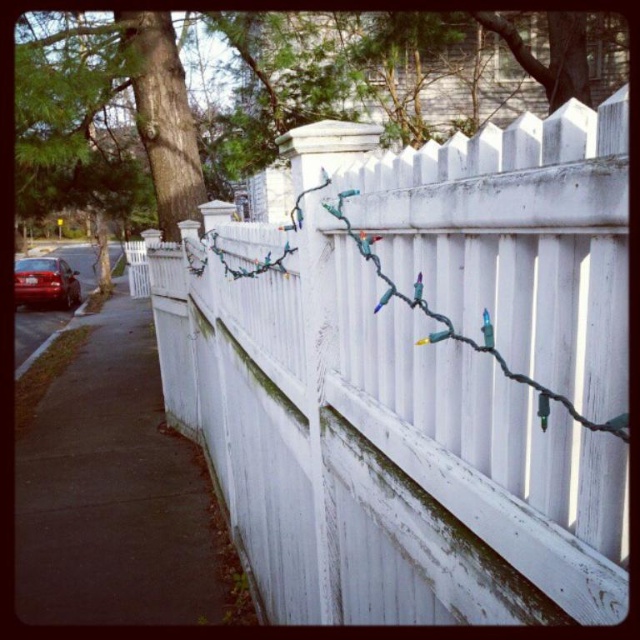
Does white painted wood fence at center lie behind matte black car at left?

No, white painted wood fence at center is in front of matte black car at left.

In the scene shown: Is white painted wood fence at center above matte black car at left?

No.

Where is `white painted wood fence at center`? This screenshot has height=640, width=640. white painted wood fence at center is located at coordinates (416, 376).